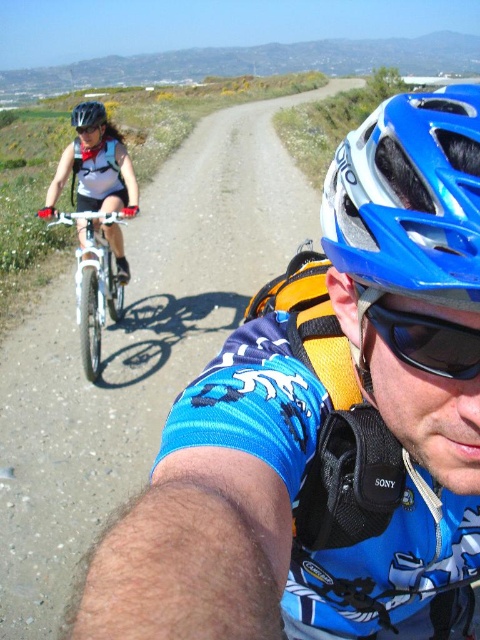
Does black matte goggles at center lie in front of matte black helmet at upper left?

Yes.

Who is more distant from viewer, (456, 330) or (76, 125)?

The point (76, 125) is behind.

Who is more distant from viewer, (477, 328) or (84, 112)?

The point (84, 112) is more distant.

Locate an element on the screen. black matte goggles at center is located at coordinates (421, 340).

Can you confirm if blue matte bicycle helmet at center is positioned below matte black helmet at upper left?

Correct, blue matte bicycle helmet at center is located below matte black helmet at upper left.

Is blue matte bicycle helmet at center to the right of matte black helmet at upper left from the viewer's perspective?

Yes, blue matte bicycle helmet at center is to the right of matte black helmet at upper left.

Locate an element on the screen. Image resolution: width=480 pixels, height=640 pixels. blue matte bicycle helmet at center is located at coordinates pos(404,204).

Where is `blue matte bicycle helmet at center`? Image resolution: width=480 pixels, height=640 pixels. blue matte bicycle helmet at center is located at coordinates (404, 204).

Which is in front, point (450, 198) or point (466, 362)?

Point (450, 198)

How much distance is there between blue matte bicycle helmet at center and black matte goggles at center?

blue matte bicycle helmet at center and black matte goggles at center are 4.28 inches apart.

The width and height of the screenshot is (480, 640). In order to click on blue matte bicycle helmet at center in this screenshot , I will do `click(404, 204)`.

Find the location of a particular element. Image resolution: width=480 pixels, height=640 pixels. blue matte bicycle helmet at center is located at coordinates (404, 204).